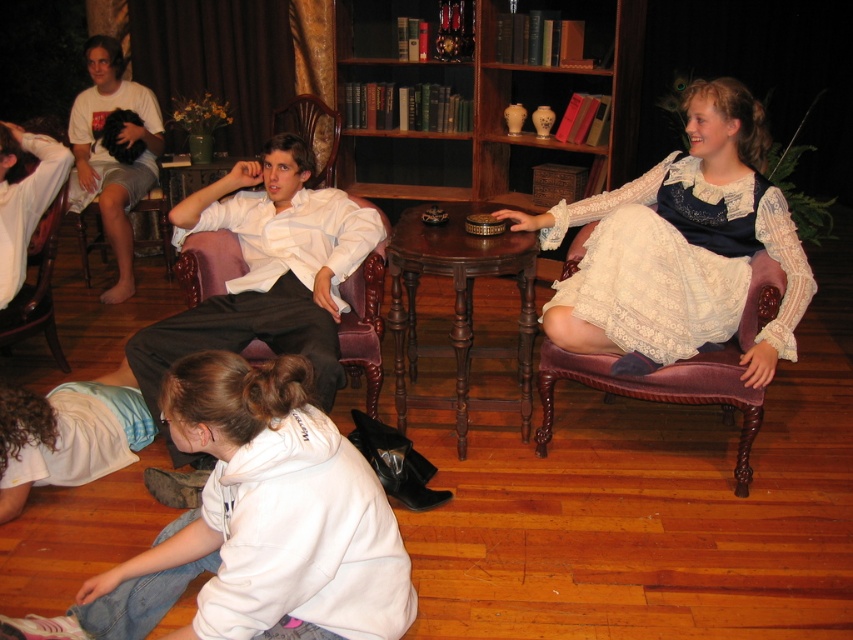
Question: Among these points, which one is farthest from the camera?

Choices:
 (A) (82, 221)
 (B) (543, 4)

Answer: (A)

Question: Which object is the farthest from the wooden bookshelf at upper center?

Choices:
 (A) velvet purple armchair at right
 (B) velvet armchair at center
 (C) velvet armchair at lower left
 (D) brown velvet armchair at left

Answer: (C)

Question: Does white lace dress at center have a lesser width compared to velvet armchair at center?

Choices:
 (A) yes
 (B) no

Answer: (B)

Question: Which of the following is the farthest from the observer?

Choices:
 (A) (76, 234)
 (B) (601, 221)

Answer: (A)

Question: Can you confirm if velvet armchair at center is positioned above velvet armchair at lower left?

Choices:
 (A) yes
 (B) no

Answer: (B)

Question: Can you confirm if white lace dress at center is wider than velvet armchair at lower left?

Choices:
 (A) yes
 (B) no

Answer: (A)